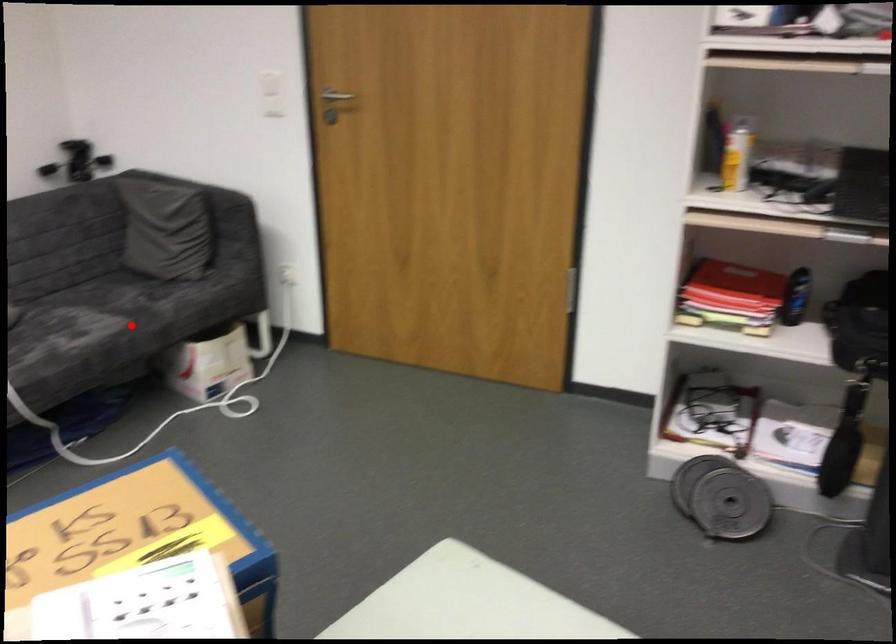
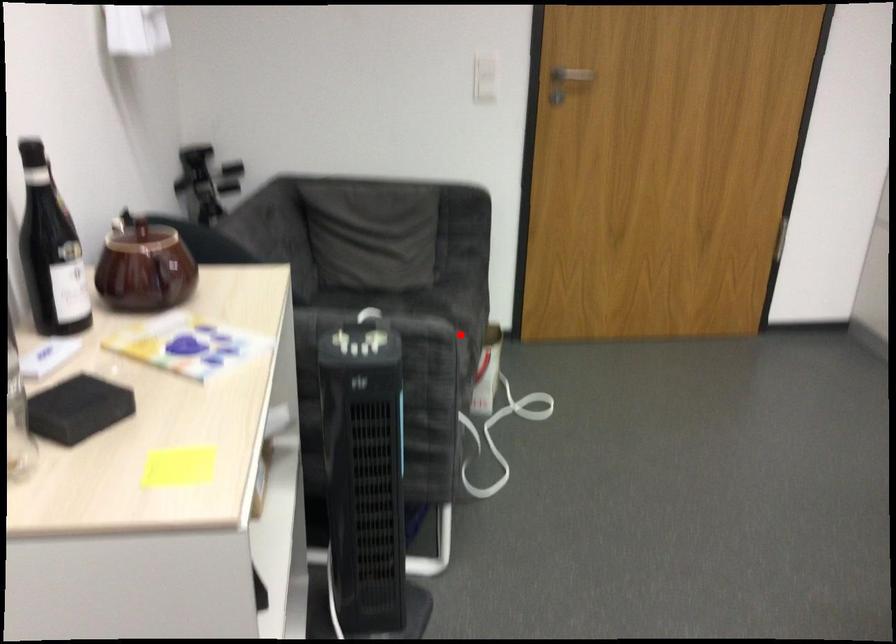
I am providing you with two images of the same scene from different viewpoints. A red point is marked on the first image and another point is marked on the second image. Is the marked point in image1 the same physical position as the marked point in image2?

Yes